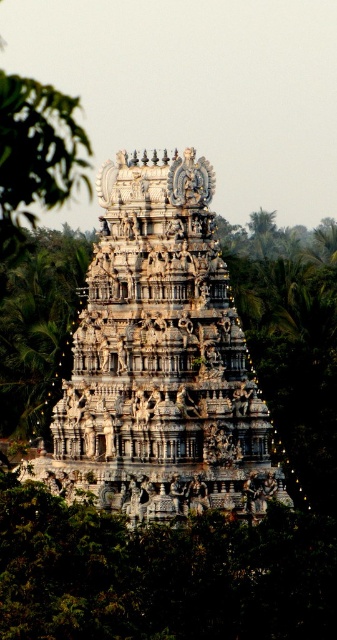
You are a photographer planning to capture the temple with both the green leafy tree at center and the green leafy tree at left in the frame. Based on their sizes, which tree would appear closer to the camera?

The green leafy tree at center appears closer to the camera because it is smaller than the green leafy tree at left.

You are standing in front of the temple and want to take a photo. The temple is at point (160, 360). Where should you position yourself to ensure the temple is centered in your photo?

You should position yourself directly in front of the temple at point (160, 360) to ensure it is centered in your photo.